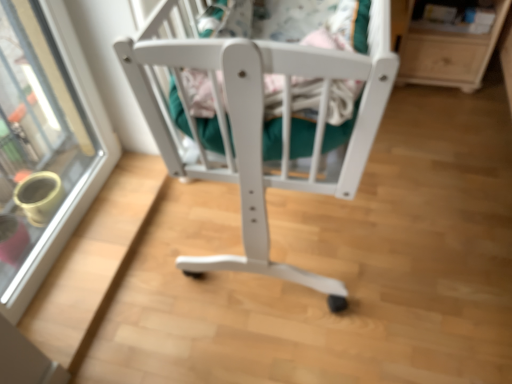
The height and width of the screenshot is (384, 512). Find the location of `light wood/texture shelf at upper right`. light wood/texture shelf at upper right is located at coordinates (448, 54).

The height and width of the screenshot is (384, 512). Describe the element at coordinates (260, 124) in the screenshot. I see `white wood crib at center` at that location.

At what (x,y) coordinates should I click in order to perform the action: click on light wood/texture shelf at upper right. Please return your answer as a coordinate pair (x, y). This screenshot has width=512, height=384. Looking at the image, I should click on (448, 54).

Locate an element on the screen. glass door in front of the white wood crib at center is located at coordinates (45, 140).

Is transparent glass door at upper left positioned far away from white wood crib at center?

transparent glass door at upper left is actually quite close to white wood crib at center.

Is transparent glass door at upper left facing away from white wood crib at center?

No, white wood crib at center is not at the back of transparent glass door at upper left.

Does transparent glass door at upper left have a lesser height compared to white wood crib at center?

Incorrect, the height of transparent glass door at upper left does not fall short of that of white wood crib at center.

Where is `glass door in front of the light wood/texture shelf at upper right`? This screenshot has width=512, height=384. glass door in front of the light wood/texture shelf at upper right is located at coordinates (45, 140).

How much distance is there between transparent glass door at upper left and light wood/texture shelf at upper right?

A distance of 1.49 meters exists between transparent glass door at upper left and light wood/texture shelf at upper right.

Is point (42, 83) behind point (458, 55)?

No, (42, 83) is closer to viewer.

Would you say transparent glass door at upper left is a long distance from light wood/texture shelf at upper right?

transparent glass door at upper left is positioned a significant distance from light wood/texture shelf at upper right.

Between white wood crib at center and light wood/texture shelf at upper right, which one appears on the left side from the viewer's perspective?

From the viewer's perspective, white wood crib at center appears more on the left side.

Is white wood crib at center touching light wood/texture shelf at upper right?

No, white wood crib at center is not with light wood/texture shelf at upper right.

Considering the sizes of white wood crib at center and light wood/texture shelf at upper right in the image, is white wood crib at center taller or shorter than light wood/texture shelf at upper right?

Considering their sizes, white wood crib at center has less height than light wood/texture shelf at upper right.

Based on the photo, between white wood crib at center and light wood/texture shelf at upper right, which one has smaller width?

With smaller width is light wood/texture shelf at upper right.

Is light wood/texture shelf at upper right oriented towards white wood crib at center?

Yes.

Consider the image. Would you say light wood/texture shelf at upper right is a long distance from white wood crib at center?

Yes, light wood/texture shelf at upper right and white wood crib at center are located far from each other.

Can you confirm if light wood/texture shelf at upper right is bigger than white wood crib at center?

No.

I want to click on shelf on the right of white wood crib at center, so click(448, 54).

How many degrees apart are the facing directions of light wood/texture shelf at upper right and transparent glass door at upper left?

The facing directions of light wood/texture shelf at upper right and transparent glass door at upper left are 90.1 degrees apart.

Looking at this image, can you confirm if light wood/texture shelf at upper right is smaller than transparent glass door at upper left?

Yes.

Which of these two, light wood/texture shelf at upper right or transparent glass door at upper left, is wider?

light wood/texture shelf at upper right is wider.

Is white wood crib at center positioned far away from transparent glass door at upper left?

No, white wood crib at center is not far away from transparent glass door at upper left.

Consider the image. What's the angular difference between white wood crib at center and transparent glass door at upper left's facing directions?

0.688 degrees separate the facing orientations of white wood crib at center and transparent glass door at upper left.

Which object is more forward, white wood crib at center or transparent glass door at upper left?

transparent glass door at upper left is in front.

Where is `furniture lying on the right of transparent glass door at upper left`? This screenshot has height=384, width=512. furniture lying on the right of transparent glass door at upper left is located at coordinates (260, 124).

Identify the location of shelf directly beneath the transparent glass door at upper left (from a real-world perspective). (448, 54).

Which object lies nearer to the anchor point transparent glass door at upper left, light wood/texture shelf at upper right or white wood crib at center?

The object closer to transparent glass door at upper left is white wood crib at center.

Considering their positions, is white wood crib at center positioned further to light wood/texture shelf at upper right than transparent glass door at upper left?

transparent glass door at upper left lies further to light wood/texture shelf at upper right than the other object.

Considering their positions, is white wood crib at center positioned further to transparent glass door at upper left than light wood/texture shelf at upper right?

Based on the image, light wood/texture shelf at upper right appears to be further to transparent glass door at upper left.

Based on their spatial positions, is transparent glass door at upper left or white wood crib at center further from light wood/texture shelf at upper right?

transparent glass door at upper left is positioned further to the anchor light wood/texture shelf at upper right.

Looking at the image, which one is located closer to white wood crib at center, light wood/texture shelf at upper right or transparent glass door at upper left?

transparent glass door at upper left.

Based on their spatial positions, is transparent glass door at upper left or light wood/texture shelf at upper right closer to white wood crib at center?

transparent glass door at upper left.

You are a GUI agent. You are given a task and a screenshot of the screen. Output one action in this format:
    pyautogui.click(x=<x>, y=<y>)
    Task: Click on the furniture situated between transparent glass door at upper left and light wood/texture shelf at upper right from left to right
    The width and height of the screenshot is (512, 384).
    Given the screenshot: What is the action you would take?
    pyautogui.click(x=260, y=124)